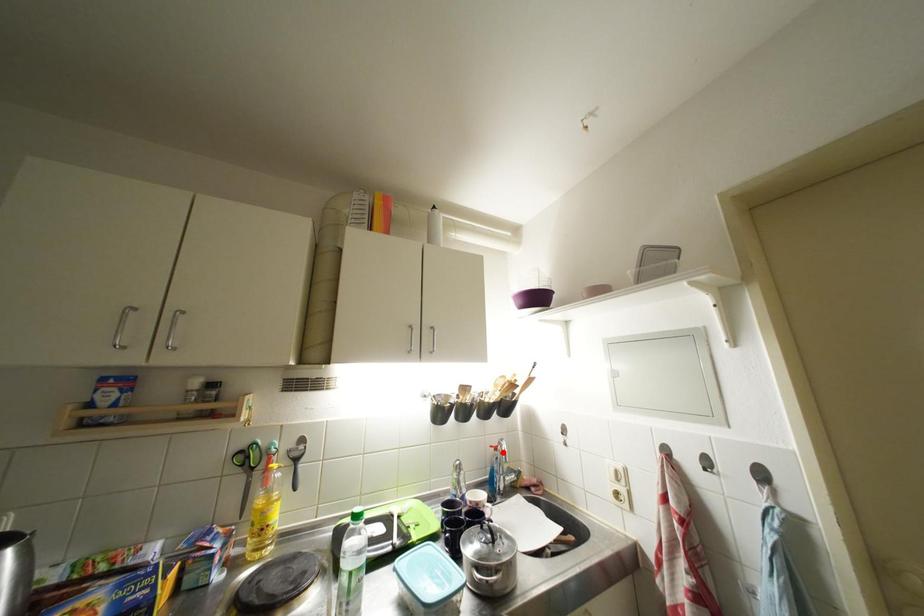
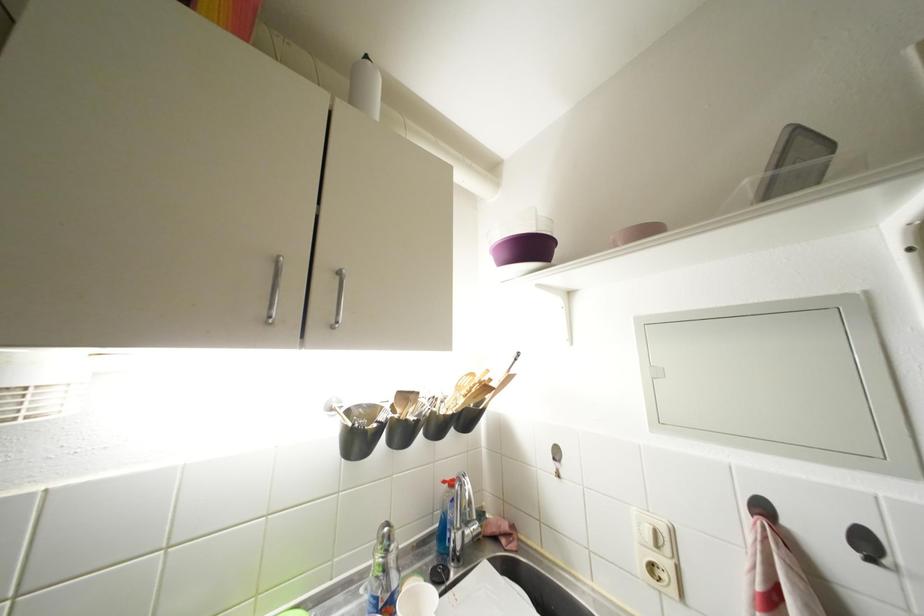
In the second image, find the point that corresponds to the highlighted location in the first image.

(457, 488)